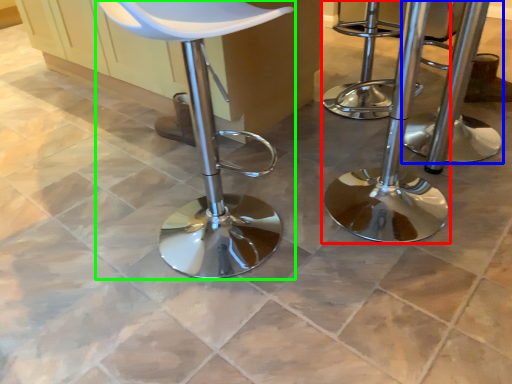
Question: Which object is positioned farthest from stool (highlighted by a red box)? Select from stool (highlighted by a blue box) and chair (highlighted by a green box).

Choices:
 (A) stool
 (B) chair

Answer: (B)